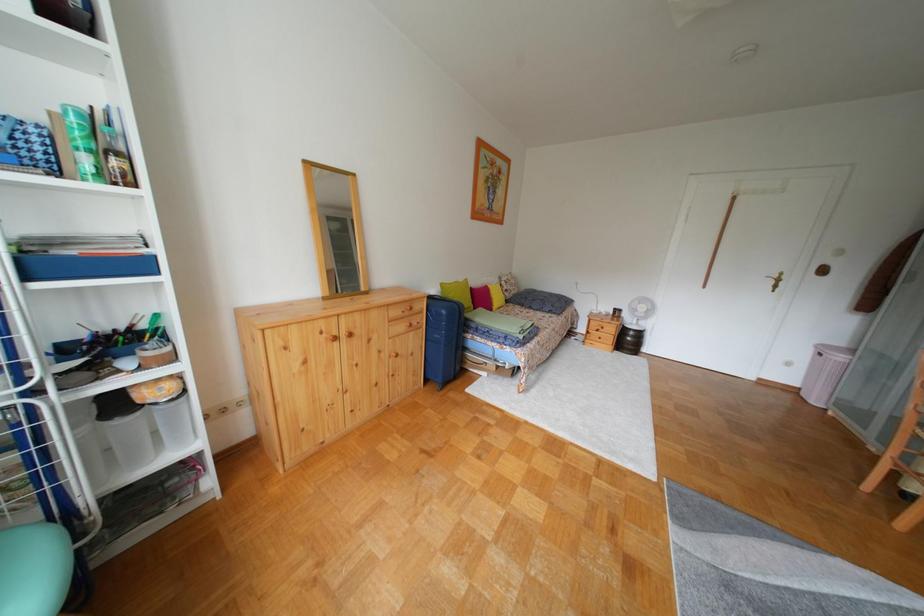
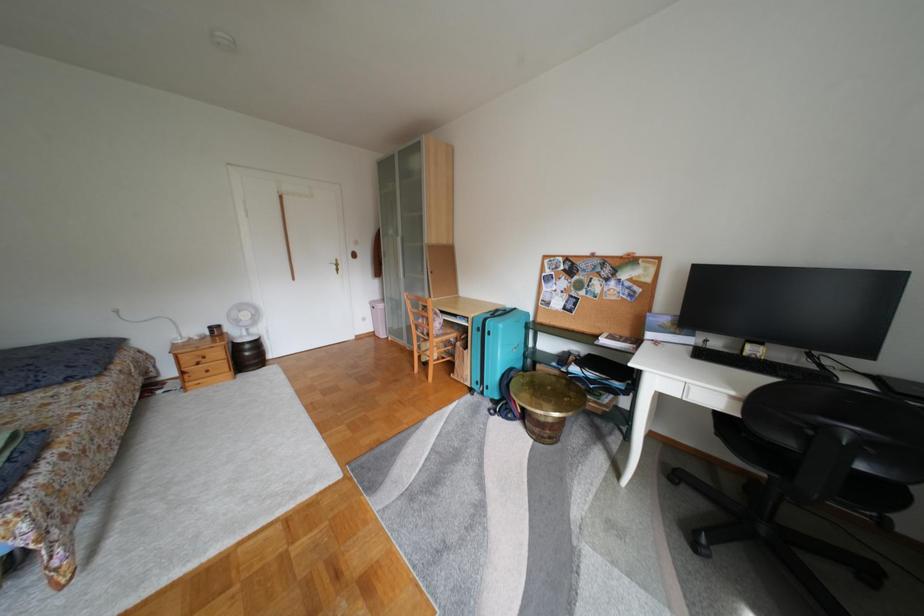
Question: The camera is either moving clockwise (left) or counter-clockwise (right) around the object. The first image is from the beginning of the video and the second image is from the end. Is the camera moving left or right when shooting the video?

Choices:
 (A) Left
 (B) Right

Answer: (A)